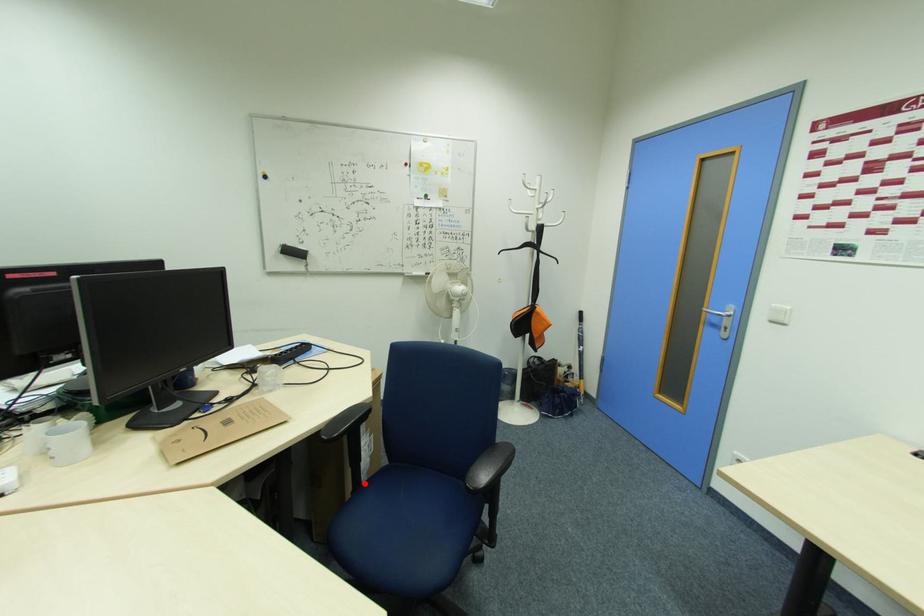
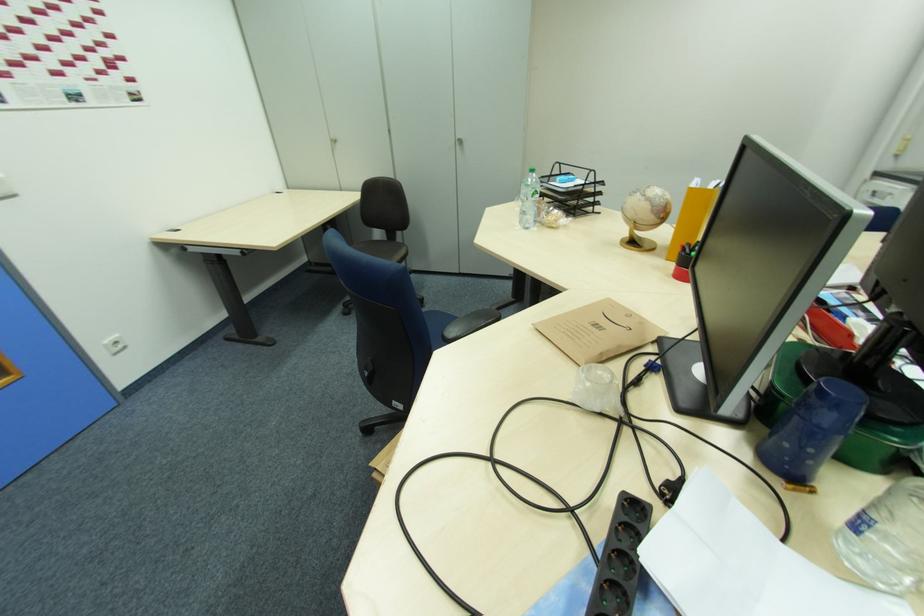
Question: I am providing you with two images of the same scene from different viewpoints. A red point is marked on the first image. Is the red point's position out of view in image 2?

Choices:
 (A) Yes
 (B) No

Answer: (A)